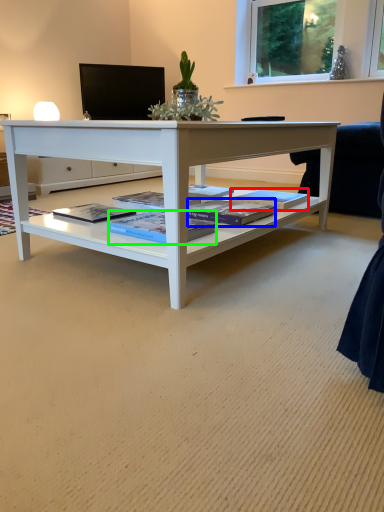
Question: Which object is positioned closest to magazine (highlighted by a red box)? Select from magazine (highlighted by a blue box) and magazine (highlighted by a green box).

Choices:
 (A) magazine
 (B) magazine

Answer: (A)